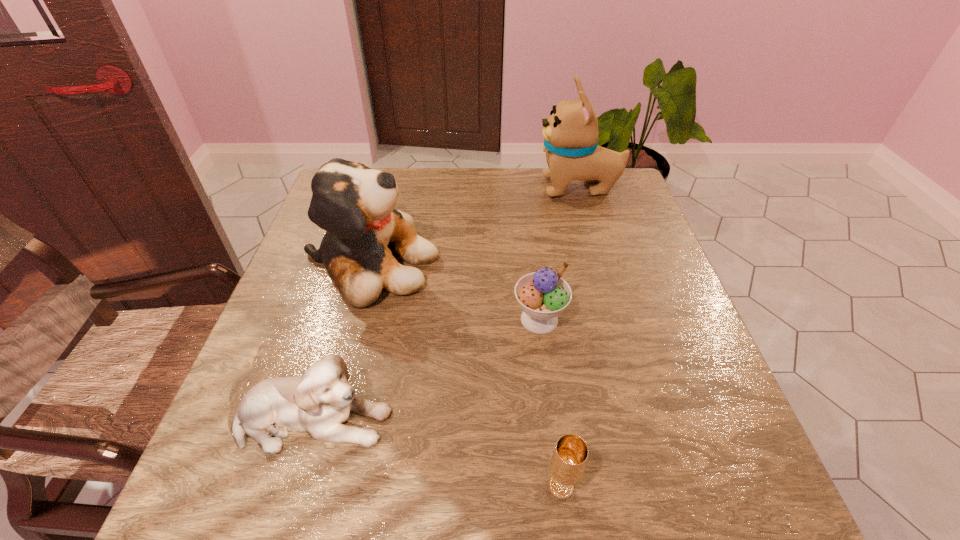
Locate an element on the screen. This screenshot has width=960, height=540. vacant area at the left edge is located at coordinates (273, 328).

In the image, there is a desktop. What are the coordinates of `vacant space at the right edge` in the screenshot? It's located at (612, 313).

At what (x,y) coordinates should I click in order to perform the action: click on vacant space at the far right corner of the desktop. Please return your answer as a coordinate pair (x, y). Looking at the image, I should click on (639, 212).

The height and width of the screenshot is (540, 960). I want to click on free space between the icecream and the nearest puppy, so click(426, 369).

You are a GUI agent. You are given a task and a screenshot of the screen. Output one action in this format:
    pyautogui.click(x=<x>, y=<y>)
    Task: Click on the vacant area that lies between the icecream and the shortest puppy
    The image size is (960, 540).
    Given the screenshot: What is the action you would take?
    pyautogui.click(x=426, y=369)

At what (x,y) coordinates should I click in order to perform the action: click on empty space between the icecream and the rightmost puppy. Please return your answer as a coordinate pair (x, y). This screenshot has height=540, width=960. Looking at the image, I should click on (559, 253).

The height and width of the screenshot is (540, 960). I want to click on free area in between the rightmost puppy and the icecream, so click(x=559, y=253).

Image resolution: width=960 pixels, height=540 pixels. Identify the location of vacant space that is in between the chalice and the farthest puppy. (570, 337).

The height and width of the screenshot is (540, 960). I want to click on vacant point located between the second nearest puppy and the nearest object, so click(466, 375).

I want to click on vacant space that is in between the fourth farthest object and the second nearest puppy, so click(x=342, y=342).